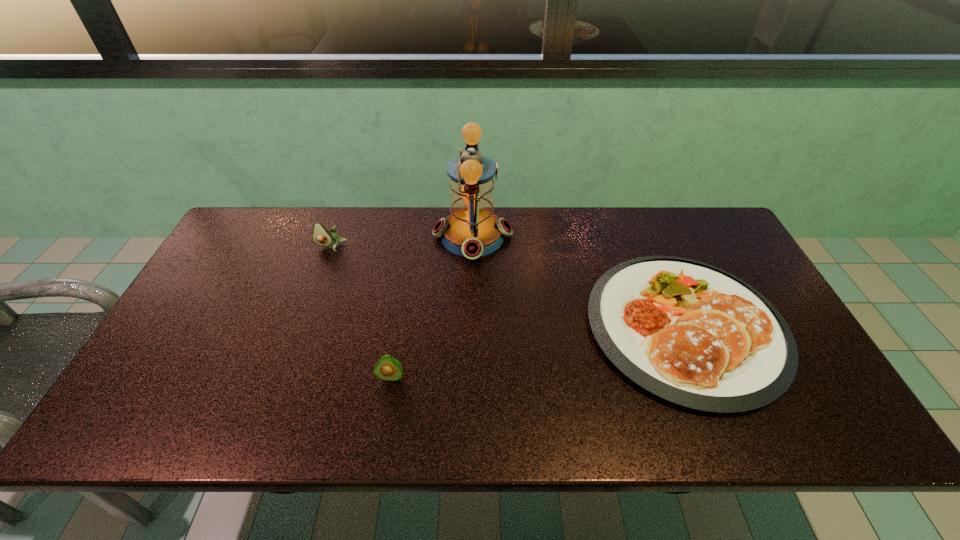
Where is `vacant area situated on the cut side of the right avocado`? The width and height of the screenshot is (960, 540). vacant area situated on the cut side of the right avocado is located at coordinates (386, 408).

Find the location of a particular element. vacant space located 0.280m on the left of the shortest object is located at coordinates (482, 327).

This screenshot has width=960, height=540. I want to click on lantern situated at the far edge, so click(x=472, y=230).

Identify the location of avocado positioned at the far edge. This screenshot has height=540, width=960. pos(321,236).

This screenshot has height=540, width=960. In order to click on object that is at the near edge in this screenshot , I will do `click(690, 333)`.

Where is `object situated at the right edge`? The height and width of the screenshot is (540, 960). object situated at the right edge is located at coordinates (690, 333).

Where is `object that is at the near right corner`? The width and height of the screenshot is (960, 540). object that is at the near right corner is located at coordinates (690, 333).

This screenshot has height=540, width=960. I want to click on vacant space at the far edge, so [594, 254].

Find the location of a particular element. Image resolution: width=960 pixels, height=540 pixels. vacant area at the near edge of the desktop is located at coordinates (530, 424).

Image resolution: width=960 pixels, height=540 pixels. In order to click on free region at the left edge in this screenshot , I will do `click(198, 394)`.